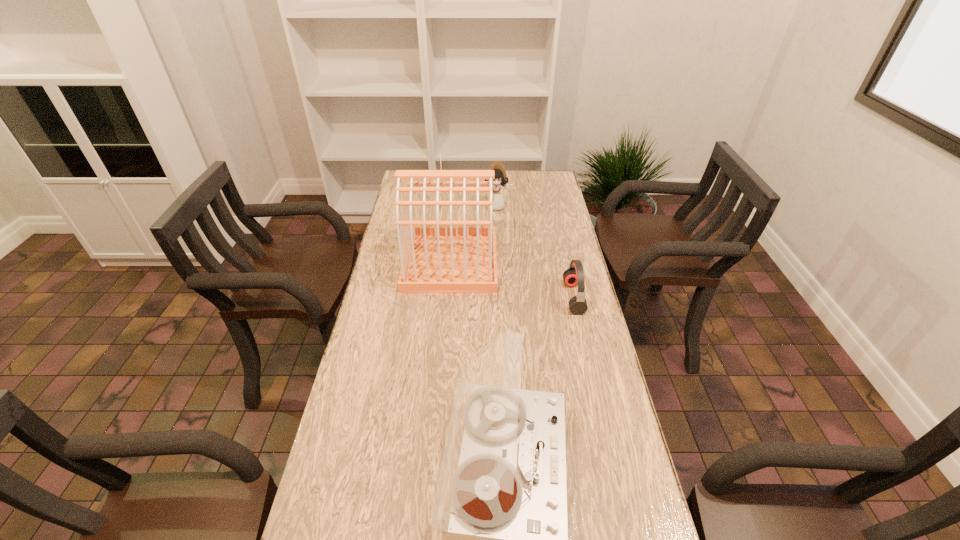
Find the location of a particular element. object that is at the left edge is located at coordinates (436, 259).

You are a GUI agent. You are given a task and a screenshot of the screen. Output one action in this format:
    pyautogui.click(x=<x>, y=<y>)
    Task: Click on the object at the right edge
    
    Given the screenshot: What is the action you would take?
    pyautogui.click(x=574, y=275)

Image resolution: width=960 pixels, height=540 pixels. I want to click on free spot at the far edge of the desktop, so click(462, 181).

Locate an element on the screen. Image resolution: width=960 pixels, height=540 pixels. vacant area at the left edge is located at coordinates (384, 489).

The image size is (960, 540). In the image, there is a desktop. Find the location of `vacant space at the right edge`. vacant space at the right edge is located at coordinates (611, 498).

This screenshot has width=960, height=540. I want to click on empty space between the earphone and the farthest object, so click(x=535, y=252).

You are a GUI agent. You are given a task and a screenshot of the screen. Output one action in this format:
    pyautogui.click(x=<x>, y=<y>)
    Task: Click on the free spot between the shortest object and the tallest object
    The width and height of the screenshot is (960, 540).
    Given the screenshot: What is the action you would take?
    (x=512, y=280)

This screenshot has width=960, height=540. What are the coordinates of `vacant area between the shortest object and the birdcage` in the screenshot? It's located at (512, 280).

Where is `vacant area that lies between the tallest object and the earphone`? vacant area that lies between the tallest object and the earphone is located at coordinates (512, 280).

Image resolution: width=960 pixels, height=540 pixels. I want to click on vacant area that lies between the tallest object and the rightmost object, so click(512, 280).